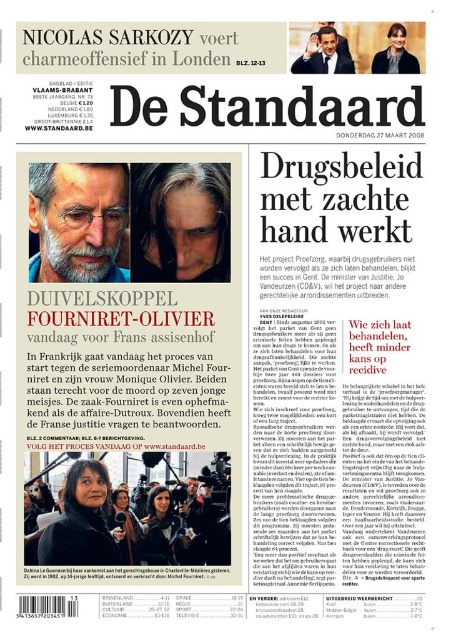
Question: Is matte black hair at upper center to the left of matte black suit at upper center from the viewer's perspective?

Choices:
 (A) yes
 (B) no

Answer: (A)

Question: Estimate the real-world distances between objects in this image. Which object is closer to the matte black hair at upper center?

Choices:
 (A) matte black face at upper center
 (B) gray hair at upper center

Answer: (B)

Question: Is matte black suit at upper center smaller than matte black face at upper center?

Choices:
 (A) no
 (B) yes

Answer: (A)

Question: Estimate the real-world distances between objects in this image. Which object is farther from the matte black face at upper center?

Choices:
 (A) gray hair at center
 (B) matte black hair at upper center
 (C) matte black suit at upper center

Answer: (B)

Question: Can you confirm if matte black suit at upper center is bigger than matte black face at upper center?

Choices:
 (A) yes
 (B) no

Answer: (A)

Question: Which object is farther from the camera taking this photo?

Choices:
 (A) gray hair at upper center
 (B) gray hair at center
 (C) matte black face at upper center

Answer: (C)